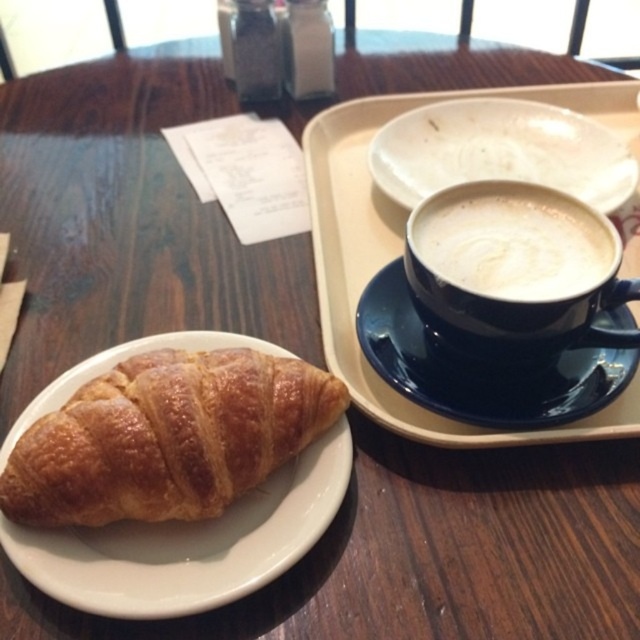
Question: Is golden brown flaky croissant at lower left below blue ceramic saucer at upper right?

Choices:
 (A) yes
 (B) no

Answer: (A)

Question: Does white frothy cappuccino at upper right lie behind white plastic tray at upper right?

Choices:
 (A) no
 (B) yes

Answer: (A)

Question: Which of the following is the farthest from the observer?

Choices:
 (A) (605, 212)
 (B) (536, 200)
 (C) (216, 508)

Answer: (A)

Question: Can you confirm if white frothy cappuccino at upper right is wider than white plastic tray at upper right?

Choices:
 (A) no
 (B) yes

Answer: (A)

Question: Based on their relative distances, which object is nearer to the blue ceramic saucer at upper right?

Choices:
 (A) white plastic tray at upper right
 (B) white ceramic plate at upper center

Answer: (A)

Question: Among these points, which one is nearest to the camera?

Choices:
 (A) (420, 240)
 (B) (332, 321)
 (C) (365, 288)

Answer: (A)